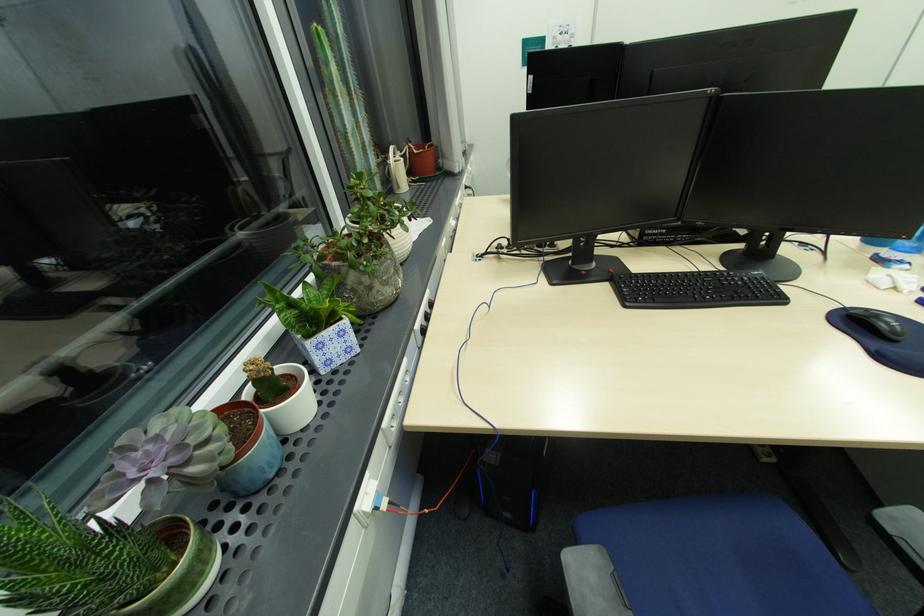
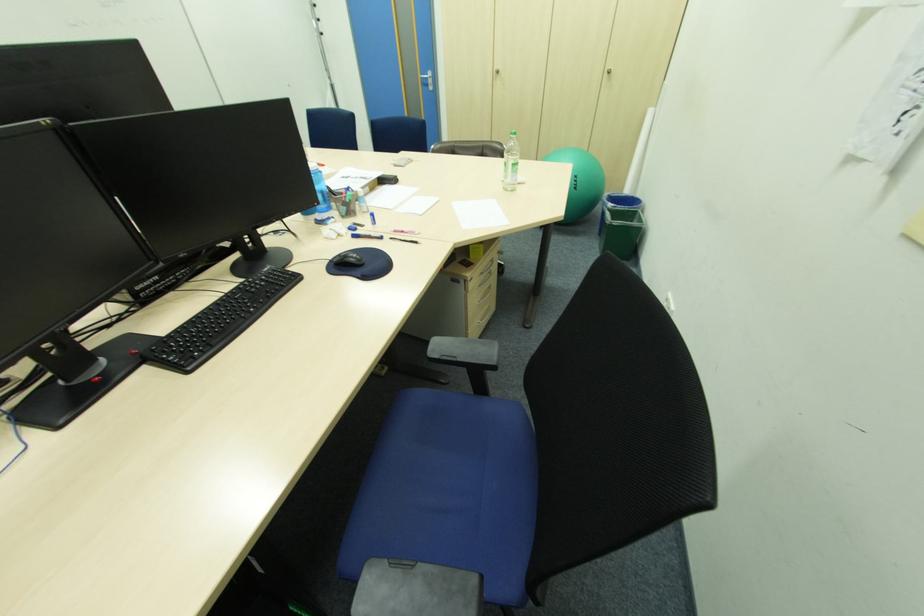
Where in the second image is the point corresponding to [888,326] from the first image?

(357, 260)